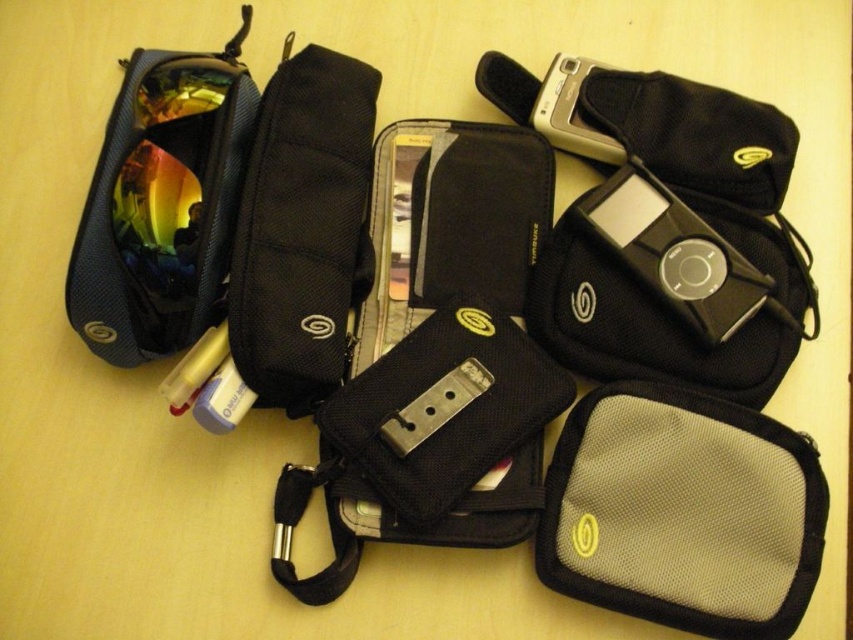
You are organizing a photography kit and need to place the silver metallic camera at upper right into the matte black pouch at upper left. Based on the scene description, will the camera fit inside the pouch?

The matte black pouch at upper left has a larger size compared to the silver metallic camera at upper right, so the camera should fit inside the pouch.

You are organizing a photography event and need to place the satin black ipod at center right and the silver metallic camera at upper right into a display case. Which item should you place first if you want to follow the left to right arrangement?

You should place the silver metallic camera at upper right first because it is to the left of the satin black ipod at center right.